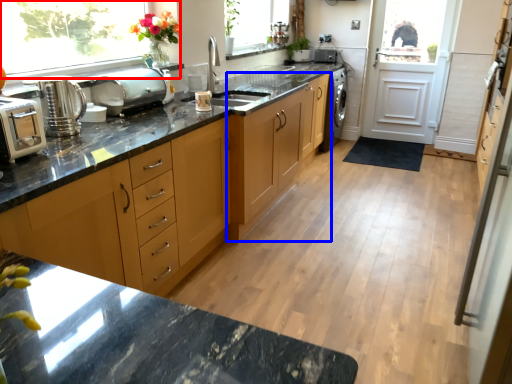
Question: Which point is closer to the camera, window (highlighted by a red box) or cabinetry (highlighted by a blue box)?

Choices:
 (A) window
 (B) cabinetry

Answer: (A)